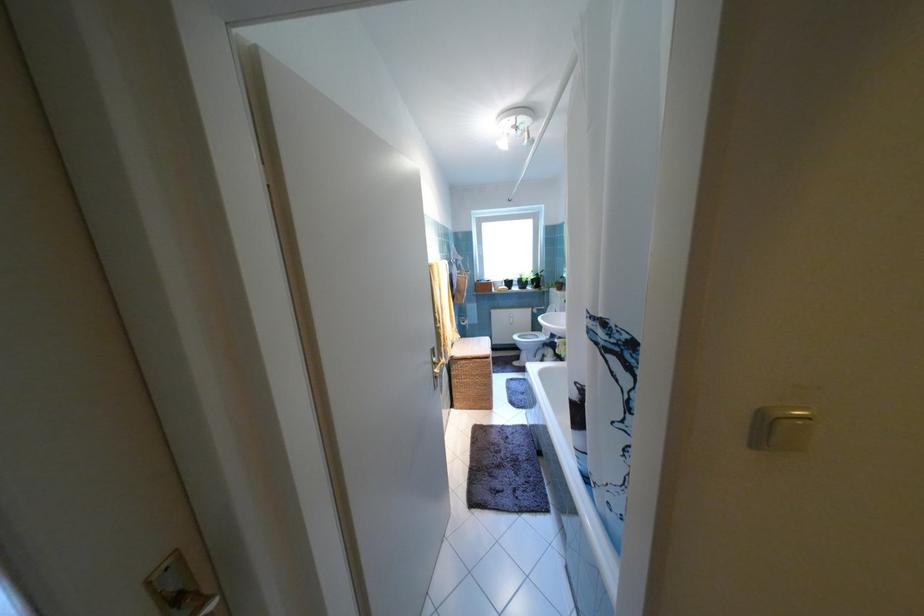
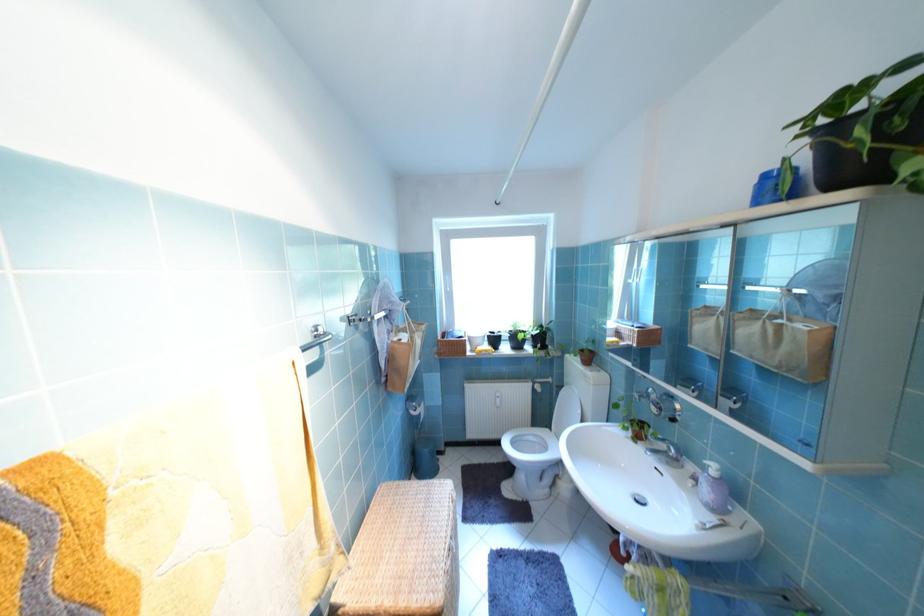
Question: Which direction would the cameraman need to move to produce the second image? Reply with the corresponding letter.

Choices:
 (A) Left
 (B) Right
 (C) Forward
 (D) Backward

Answer: (C)